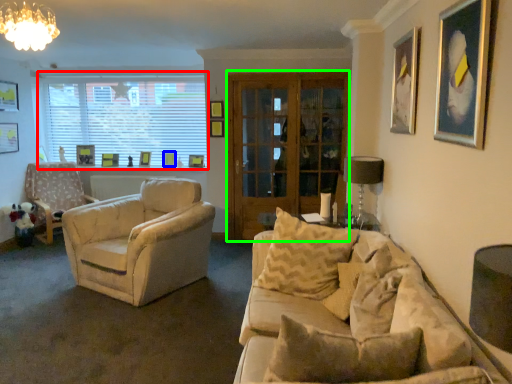
Question: Which object is positioned farthest from window (highlighted by a red box)? Select from picture frame (highlighted by a blue box) and glass door (highlighted by a green box).

Choices:
 (A) picture frame
 (B) glass door

Answer: (B)